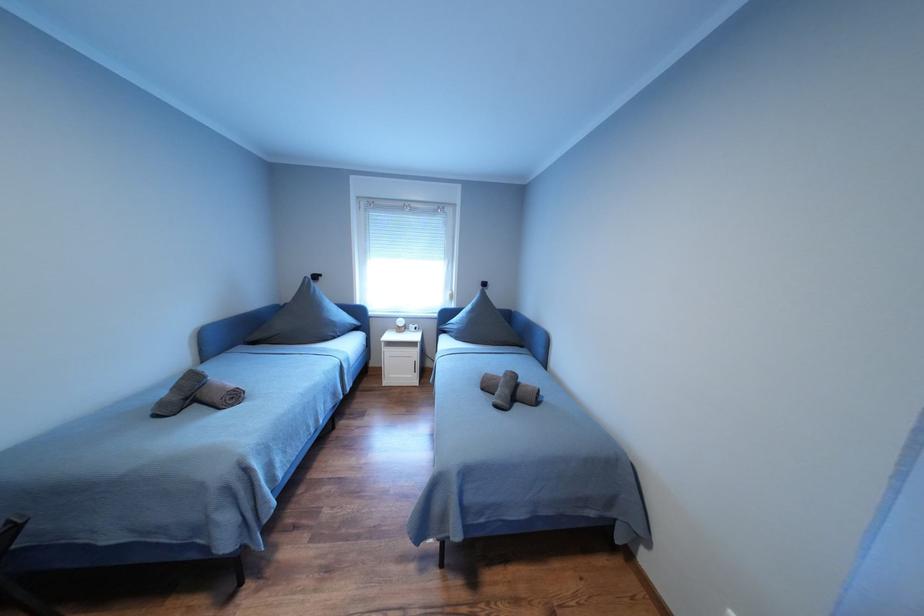
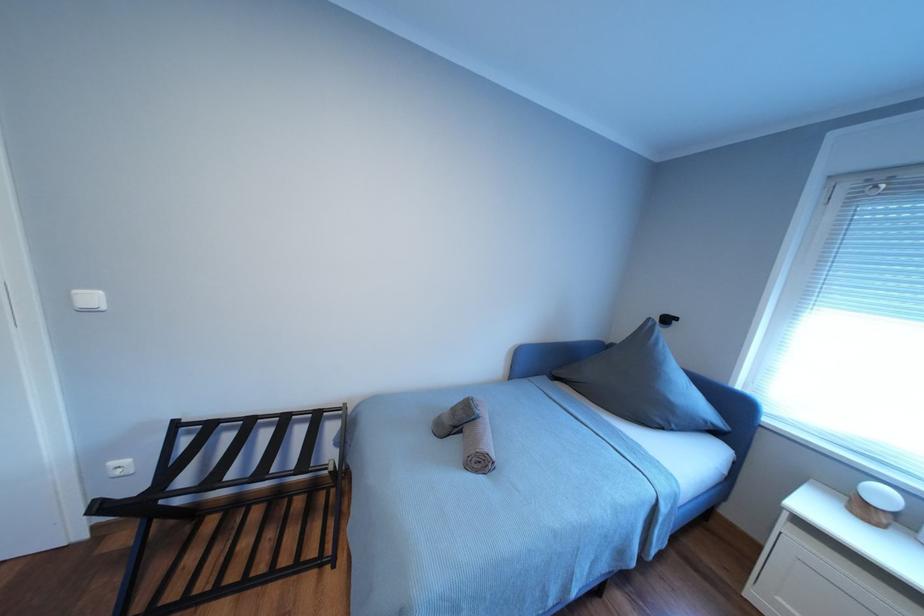
Question: Based on the continuous images, in which direction is the camera rotating? Reply with the corresponding letter.

Choices:
 (A) Left
 (B) Right
 (C) Up
 (D) Down

Answer: (A)